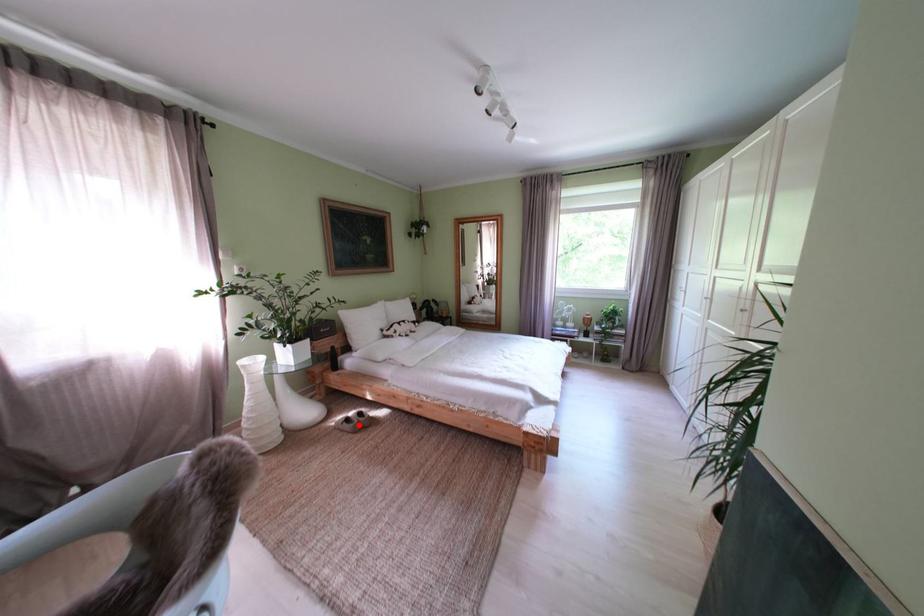
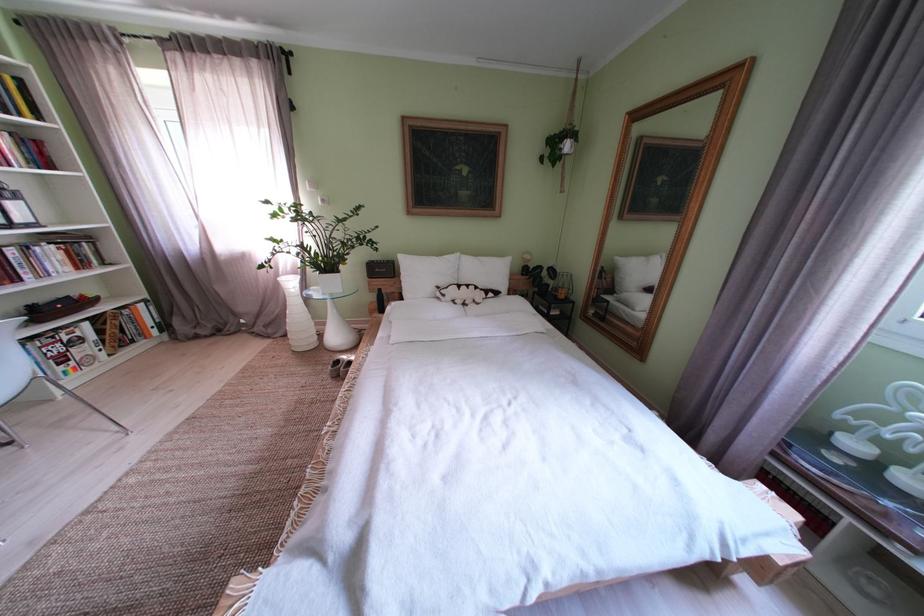
Locate, in the second image, the point that corresponds to the highlighted location in the first image.

(348, 367)